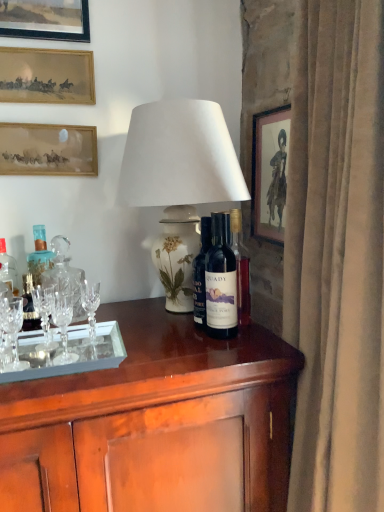
At what (x,y) coordinates should I click in order to perform the action: click on free spot in front of dark blue glass bottle at center, which is counted as the third bottle, starting from the left. Please return your answer as a coordinate pair (x, y). The image size is (384, 512). Looking at the image, I should click on (215, 365).